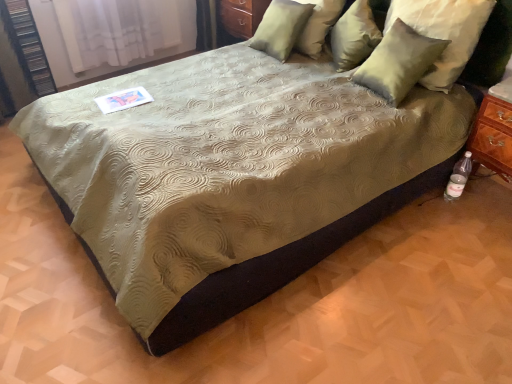
Question: Should I look upward or downward to see suede-like beige pillow at upper right, acting as the 2th pillow starting from the left?

Choices:
 (A) up
 (B) down

Answer: (A)

Question: From a real-world perspective, is satin green pillow at upper right, the third pillow viewed from the left, under clear plastic bottle at lower right?

Choices:
 (A) yes
 (B) no

Answer: (B)

Question: Considering the relative positions of satin green pillow at upper right, the third pillow viewed from the left, and clear plastic bottle at lower right in the image provided, is satin green pillow at upper right, the third pillow viewed from the left, behind clear plastic bottle at lower right?

Choices:
 (A) yes
 (B) no

Answer: (B)

Question: Is satin green pillow at upper right, marked as the second pillow in a right-to-left arrangement, looking in the opposite direction of clear plastic bottle at lower right?

Choices:
 (A) yes
 (B) no

Answer: (B)

Question: From the image's perspective, does satin green pillow at upper right, the third pillow viewed from the left, appear higher than clear plastic bottle at lower right?

Choices:
 (A) no
 (B) yes

Answer: (B)

Question: Does satin green pillow at upper right, marked as the second pillow in a right-to-left arrangement, lie in front of clear plastic bottle at lower right?

Choices:
 (A) yes
 (B) no

Answer: (A)

Question: Would you consider matte wood dresser at upper center to be distant from clear plastic bottle at lower right?

Choices:
 (A) yes
 (B) no

Answer: (A)

Question: Can you confirm if matte wood dresser at upper center is taller than clear plastic bottle at lower right?

Choices:
 (A) no
 (B) yes

Answer: (B)

Question: Could you tell me if matte wood dresser at upper center is turned towards clear plastic bottle at lower right?

Choices:
 (A) yes
 (B) no

Answer: (B)

Question: Is matte wood dresser at upper center to the left of clear plastic bottle at lower right from the viewer's perspective?

Choices:
 (A) no
 (B) yes

Answer: (B)

Question: From the image's perspective, is matte wood dresser at upper center beneath clear plastic bottle at lower right?

Choices:
 (A) yes
 (B) no

Answer: (B)

Question: Is matte wood dresser at upper center beside clear plastic bottle at lower right?

Choices:
 (A) yes
 (B) no

Answer: (B)

Question: From the image's perspective, is satin green pillow at upper right, the fourth pillow from the left, below satin green pillow at upper right, acting as the 4th pillow starting from the right?

Choices:
 (A) no
 (B) yes

Answer: (B)